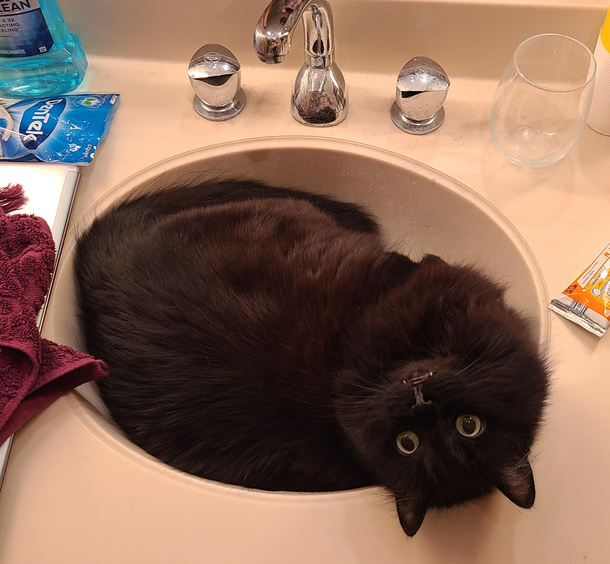
Find the location of `faucet handles`. faucet handles is located at coordinates (210, 74), (418, 85).